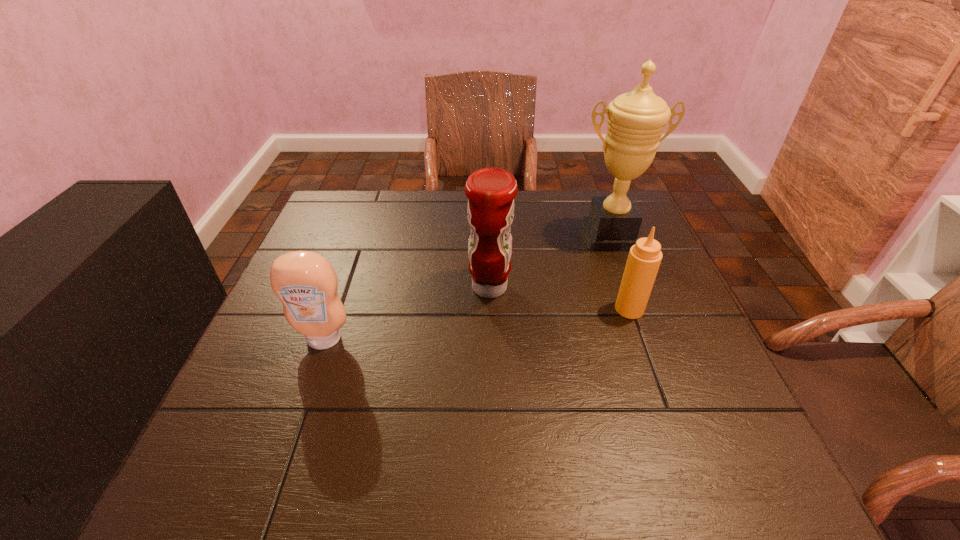
Identify the location of trophy cup. This screenshot has width=960, height=540. (636, 120).

At what (x,y) coordinates should I click in order to perform the action: click on the tallest object. Please return your answer as a coordinate pair (x, y). Looking at the image, I should click on (636, 120).

This screenshot has height=540, width=960. In order to click on the third object from right to left in this screenshot , I will do `click(491, 191)`.

Where is `the tallest condiment`? the tallest condiment is located at coordinates (491, 191).

Where is `the rightmost condiment`? The height and width of the screenshot is (540, 960). the rightmost condiment is located at coordinates (644, 258).

Locate an element on the screen. the nearest condiment is located at coordinates (305, 282).

I want to click on the nearest object, so coord(305,282).

The image size is (960, 540). I want to click on free space located at the front of the trophy cup with handles, so click(657, 362).

Locate an element on the screen. The image size is (960, 540). vacant space located on the back of the second condiment from right to left is located at coordinates (489, 233).

You are a GUI agent. You are given a task and a screenshot of the screen. Output one action in this format:
    pyautogui.click(x=<x>, y=<y>)
    Task: Click on the free space located 0.090m on the front of the rightmost condiment
    
    Given the screenshot: What is the action you would take?
    (644, 350)